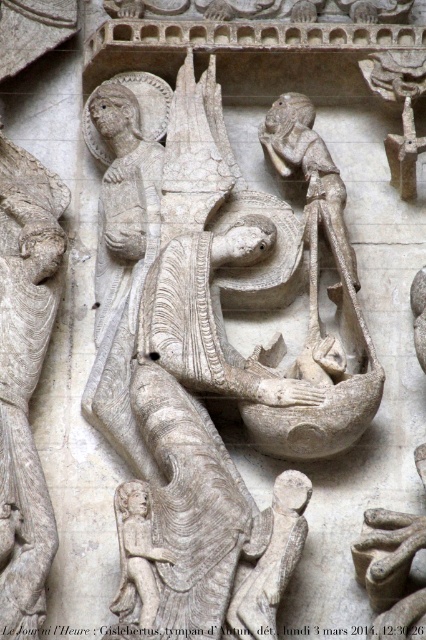
Consider the image. Based on the scene described, which object is taller between the stone statue at center and the white stone angel at upper left?

The stone statue at center is much taller than the white stone angel at upper left.

You are a photographer standing at the camera position. You want to take a closeup photo of the stone statue at center. The statue is 68.53 meters away from you. Your camera has a maximum zoom range of 50 meters. Can you capture the statue clearly in your photo?

The stone statue at center is 68.53 meters from camera. Since your camera can only zoom up to 50 meters, you cannot capture the statue clearly in your photo.

Based on the scene described, which object is positioned higher in the image? The stone statue at center or the white stone angel at upper left?

The stone statue at center is positioned higher than the white stone angel at upper left according to the description.